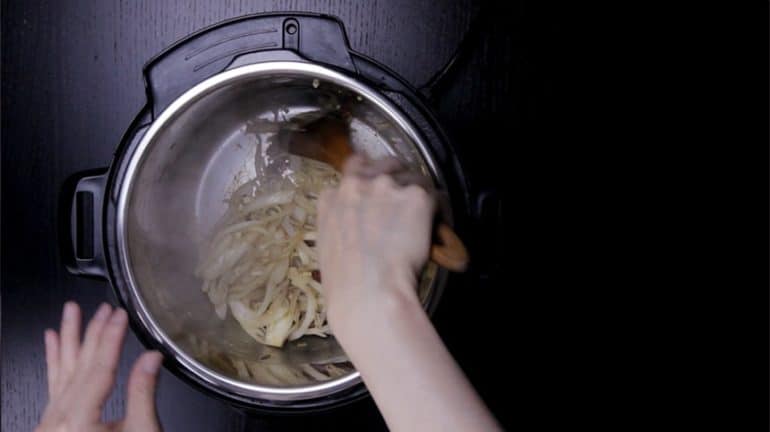
This screenshot has height=432, width=770. I want to click on table, so click(x=49, y=89).